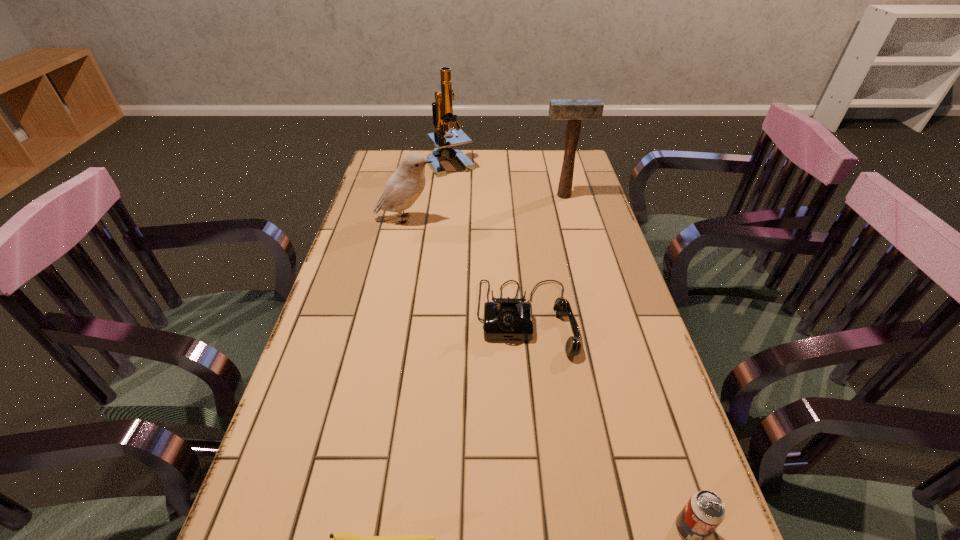
Locate an element on the screen. The width and height of the screenshot is (960, 540). the farthest object is located at coordinates (442, 109).

The image size is (960, 540). In order to click on mallet in this screenshot , I will do `click(574, 110)`.

I want to click on the fourth shortest object, so click(403, 188).

The image size is (960, 540). In order to click on bird in this screenshot , I will do `click(403, 188)`.

I want to click on the third nearest object, so click(x=508, y=318).

Locate an element on the screen. The image size is (960, 540). blank space located at the eyepiece of the microscope is located at coordinates (445, 213).

Where is `vacant space situated 0.130m on the front of the mallet`? vacant space situated 0.130m on the front of the mallet is located at coordinates (570, 221).

This screenshot has height=540, width=960. I want to click on vacant space located 0.120m at the beak of the bird, so click(475, 219).

Identify the location of vacant area located 0.240m on the dial of the third nearest object. (541, 467).

Where is `object at the far edge`? This screenshot has height=540, width=960. object at the far edge is located at coordinates (442, 109).